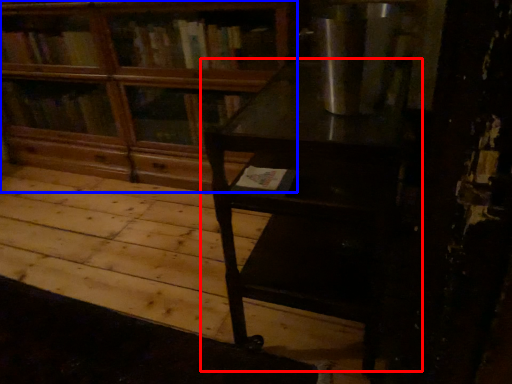
Question: Among these objects, which one is nearest to the camera, table (highlighted by a red box) or bookcase (highlighted by a blue box)?

Choices:
 (A) table
 (B) bookcase

Answer: (A)